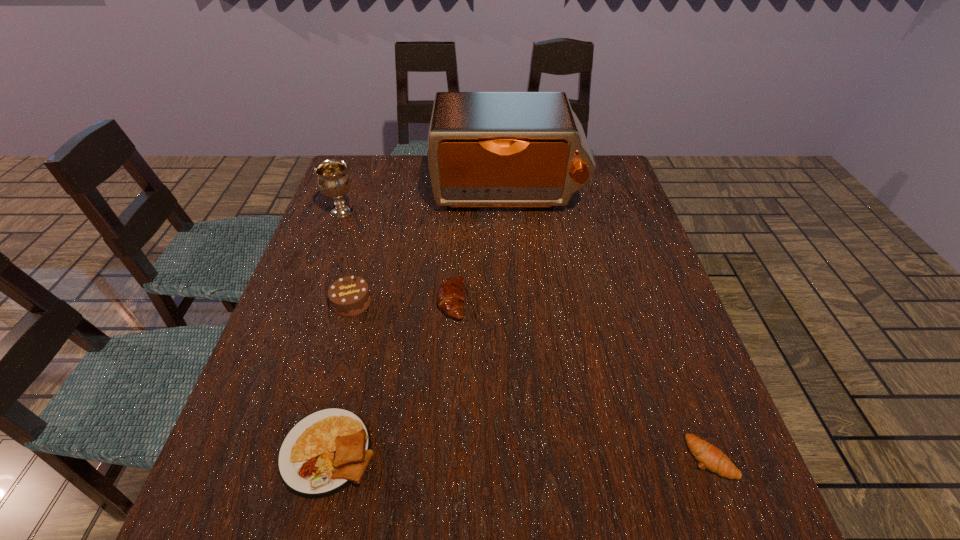
This screenshot has width=960, height=540. Identify the location of vacant region that satisfies the following two spatial constraints: 1. on the front side of the fourth tallest object; 2. on the left side of the nearer crescent roll. (442, 457).